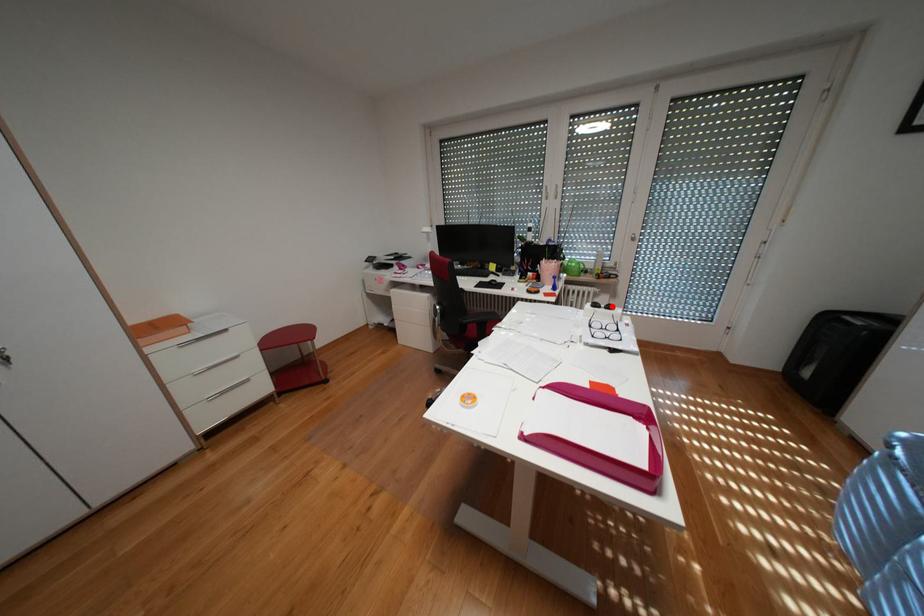
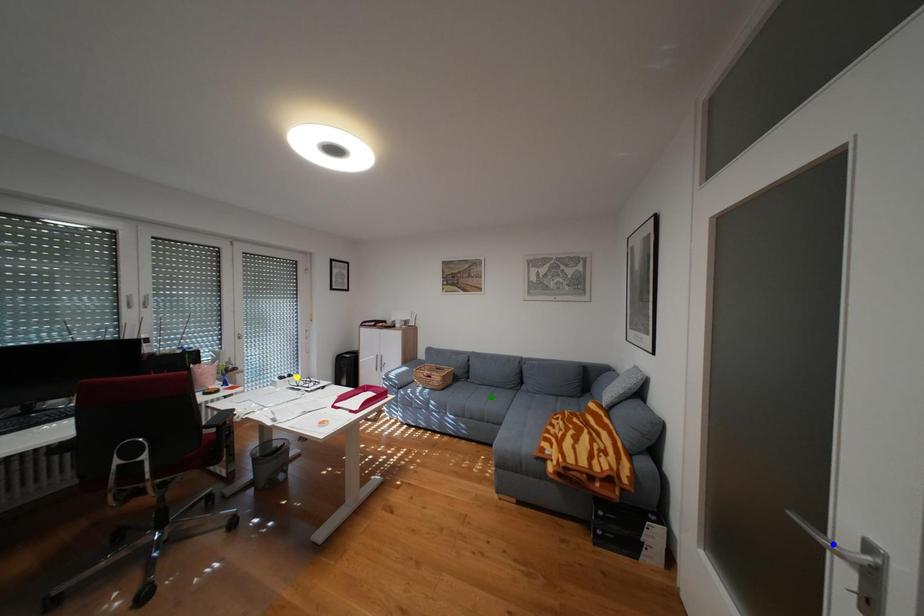
Question: I am providing you with two images of the same scene from different viewpoints. A red point is marked on the first image. You are given multiple points on the second image. In image 2, which mark is for the same physical point as the one in image 1?

Choices:
 (A) blue point
 (B) yellow point
 (C) green point

Answer: (B)